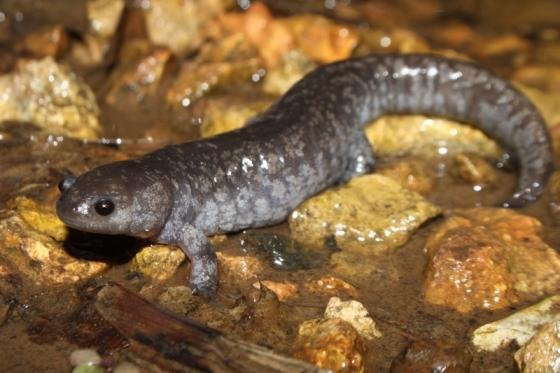
In order to click on left front leg in this screenshot , I will do `click(200, 260)`, `click(345, 231)`.